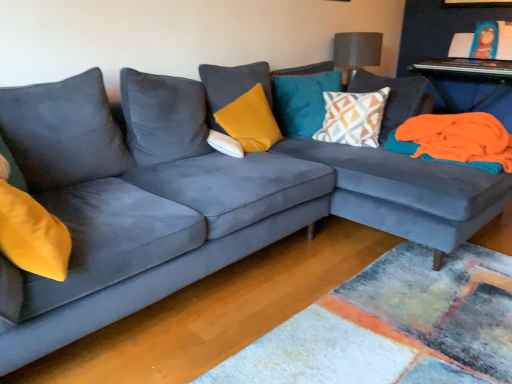
Question: Is there a large distance between textured gray lampshade at upper center and teal velvet pillow at upper center, positioned as the 2th pillow in right-to-left order?

Choices:
 (A) no
 (B) yes

Answer: (A)

Question: Does textured gray lampshade at upper center have a lesser height compared to teal velvet pillow at upper center, positioned as the 2th pillow in right-to-left order?

Choices:
 (A) no
 (B) yes

Answer: (B)

Question: Does textured gray lampshade at upper center have a smaller size compared to teal velvet pillow at upper center, the third pillow viewed from the left?

Choices:
 (A) no
 (B) yes

Answer: (A)

Question: Can we say textured gray lampshade at upper center lies outside teal velvet pillow at upper center, the third pillow viewed from the left?

Choices:
 (A) yes
 (B) no

Answer: (A)

Question: Is textured gray lampshade at upper center to the right of teal velvet pillow at upper center, the third pillow viewed from the left, from the viewer's perspective?

Choices:
 (A) yes
 (B) no

Answer: (A)

Question: Would you say orange fleece blanket at right is inside or outside metallic silver keyboard at upper right, which ranks as the 2th table in bottom-to-top order?

Choices:
 (A) outside
 (B) inside

Answer: (A)

Question: Considering the relative positions of orange fleece blanket at right and metallic silver keyboard at upper right, which ranks as the 2th table in bottom-to-top order, in the image provided, is orange fleece blanket at right to the left or to the right of metallic silver keyboard at upper right, which ranks as the 2th table in bottom-to-top order,?

Choices:
 (A) right
 (B) left

Answer: (B)

Question: Looking at their shapes, would you say orange fleece blanket at right is wider or thinner than metallic silver keyboard at upper right, the 1th table viewed from the top?

Choices:
 (A) thin
 (B) wide

Answer: (A)

Question: From the image's perspective, is orange fleece blanket at right above or below metallic silver keyboard at upper right, the 1th table viewed from the top?

Choices:
 (A) above
 (B) below

Answer: (B)

Question: Is geometric-patterned fabric pillow at center, the fourth pillow positioned from the left, bigger or smaller than teal velvet pillow at upper center, the third pillow viewed from the left?

Choices:
 (A) small
 (B) big

Answer: (B)

Question: From the image's perspective, is geometric-patterned fabric pillow at center, the fourth pillow positioned from the left, above or below teal velvet pillow at upper center, the third pillow viewed from the left?

Choices:
 (A) above
 (B) below

Answer: (B)

Question: From a real-world perspective, is geometric-patterned fabric pillow at center, the fourth pillow positioned from the left, above or below teal velvet pillow at upper center, positioned as the 2th pillow in right-to-left order?

Choices:
 (A) below
 (B) above

Answer: (A)

Question: Considering the relative positions of geometric-patterned fabric pillow at center, the fourth pillow positioned from the left, and teal velvet pillow at upper center, the third pillow viewed from the left, in the image provided, is geometric-patterned fabric pillow at center, the fourth pillow positioned from the left, to the left or to the right of teal velvet pillow at upper center, the third pillow viewed from the left,?

Choices:
 (A) right
 (B) left

Answer: (A)

Question: In terms of size, does orange fabric at right, positioned as the 2th table in top-to-bottom order, appear bigger or smaller than textured gray lampshade at upper center?

Choices:
 (A) big
 (B) small

Answer: (A)

Question: Considering the positions of orange fabric at right, positioned as the 2th table in top-to-bottom order, and textured gray lampshade at upper center in the image, is orange fabric at right, positioned as the 2th table in top-to-bottom order, taller or shorter than textured gray lampshade at upper center?

Choices:
 (A) tall
 (B) short

Answer: (A)